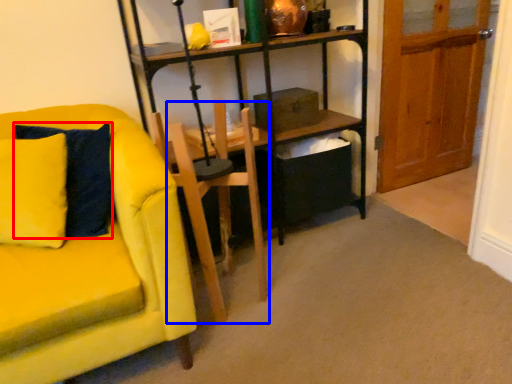
Question: Which point is further to the camera, pillow (highlighted by a red box) or armchair (highlighted by a blue box)?

Choices:
 (A) pillow
 (B) armchair

Answer: (B)